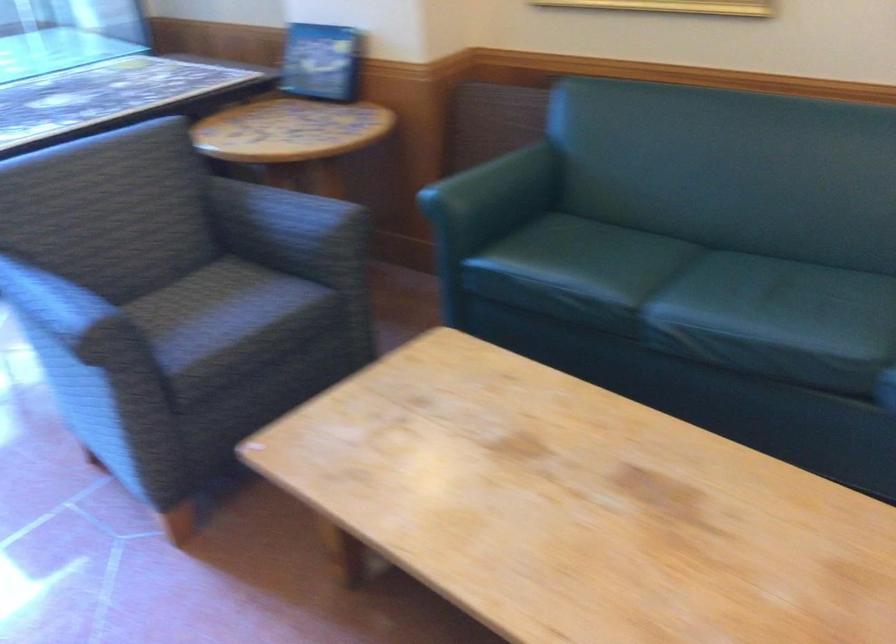
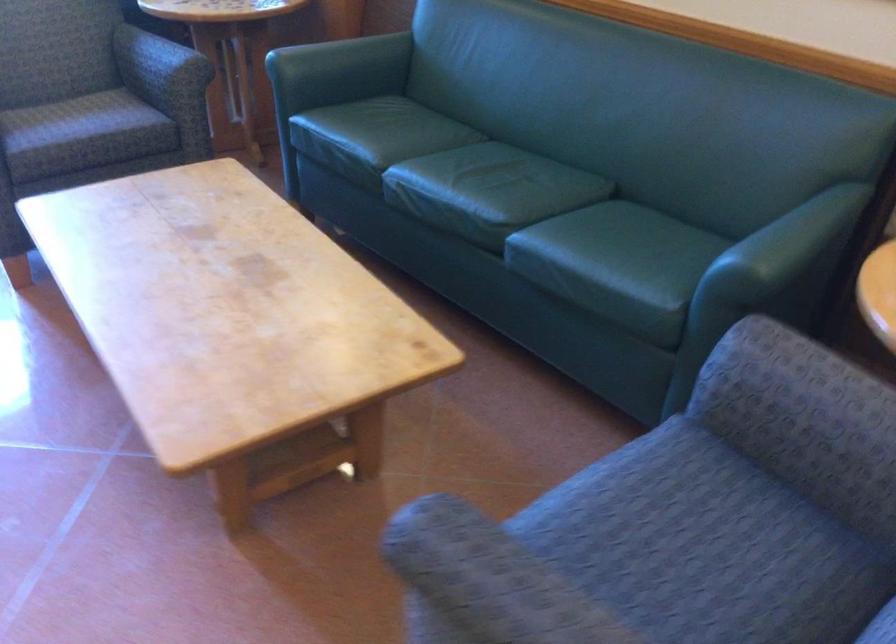
Where in the second image is the point corresponding to point 595,272 from the first image?

(374, 137)